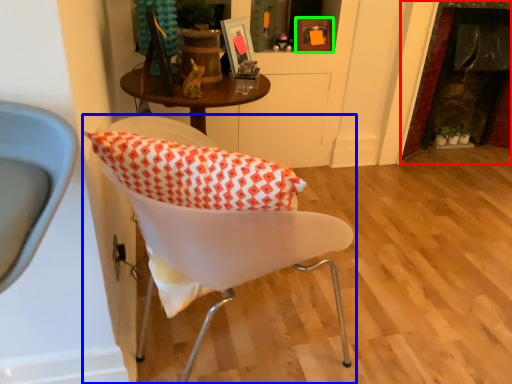
Question: Estimate the real-world distances between objects in this image. Which object is closer to fireplace (highlighted by a red box), chair (highlighted by a blue box) or picture frame (highlighted by a green box)?

Choices:
 (A) chair
 (B) picture frame

Answer: (B)